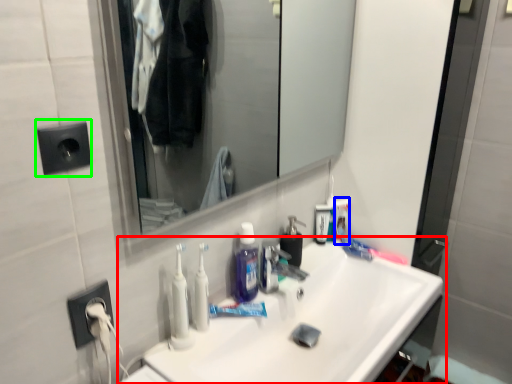
Question: Considering the real-world distances, which object is farthest from sink (highlighted by a red box)? toiletry (highlighted by a blue box) or electric outlet (highlighted by a green box)?

Choices:
 (A) toiletry
 (B) electric outlet

Answer: (B)